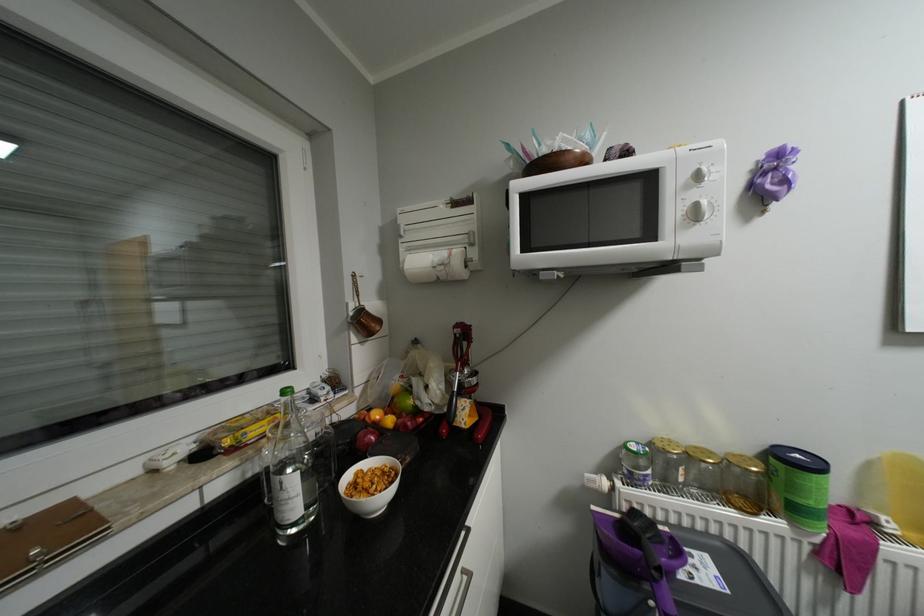
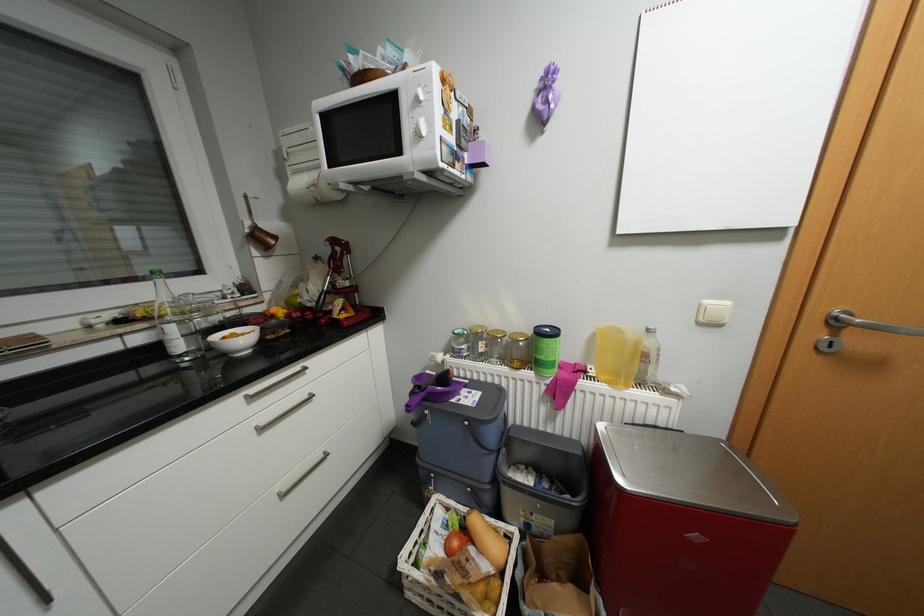
The point at (360, 304) is marked in the first image. Where is the corresponding point in the second image?

(256, 223)